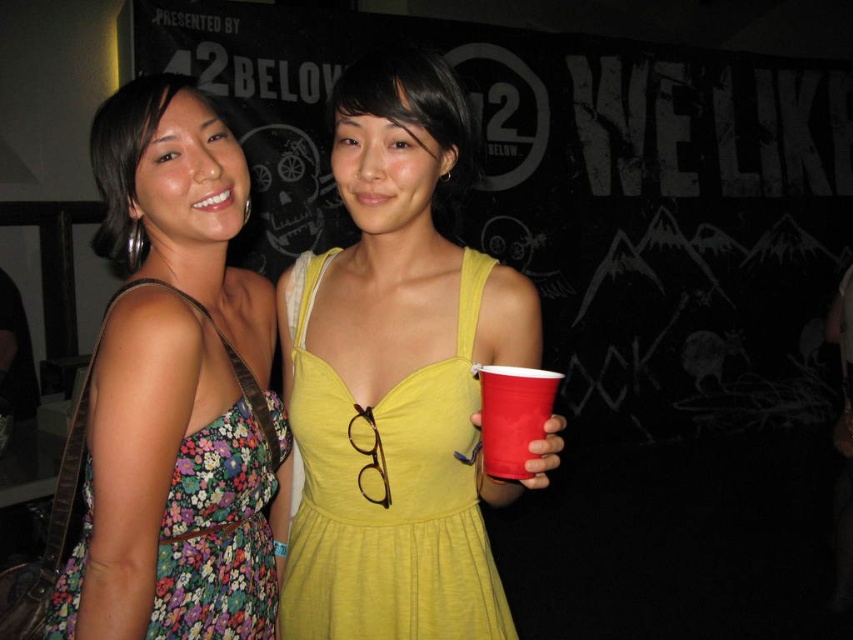
Question: Can you confirm if floral fabric dress at left is positioned to the right of yellow fabric dress at center?

Choices:
 (A) yes
 (B) no

Answer: (B)

Question: Estimate the real-world distances between objects in this image. Which object is closer to the red plastic cup at center?

Choices:
 (A) yellow fabric dress at center
 (B) floral fabric dress at left

Answer: (A)

Question: Can you confirm if floral fabric dress at left is smaller than yellow fabric dress at center?

Choices:
 (A) yes
 (B) no

Answer: (B)

Question: Which object is closer to the camera taking this photo?

Choices:
 (A) yellow fabric dress at center
 (B) red plastic cup at center

Answer: (B)

Question: From the image, what is the correct spatial relationship of floral fabric dress at left in relation to red plastic cup at center?

Choices:
 (A) left
 (B) right

Answer: (A)

Question: Which point is farther to the camera?

Choices:
 (A) red plastic cup at center
 (B) floral fabric dress at left
 (C) yellow fabric dress at center

Answer: (C)